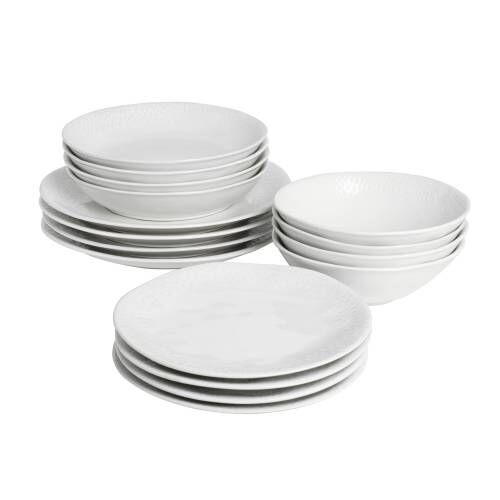
Identify the location of plates. Image resolution: width=500 pixels, height=500 pixels. (268, 410), (270, 400), (272, 390), (265, 359), (171, 260), (169, 252), (172, 236), (175, 227).